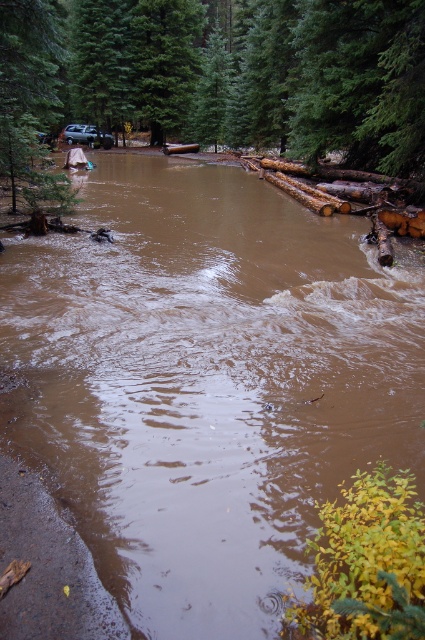
Is green matte tree at upper left wider than metallic silver suv at upper left?

Yes, green matte tree at upper left is wider than metallic silver suv at upper left.

Is green matte tree at upper left below metallic silver suv at upper left?

Yes, green matte tree at upper left is below metallic silver suv at upper left.

Who is more forward, (2, 4) or (73, 125)?

Point (2, 4)

Identify the location of green matte tree at upper left. tap(28, 80).

Measure the distance between green matte tree at upper center and green matte tree at upper left.

7.55 meters

Does green matte tree at upper center lie in front of green matte tree at upper left?

No, green matte tree at upper center is behind green matte tree at upper left.

Image resolution: width=425 pixels, height=640 pixels. I want to click on green matte tree at upper center, so point(224,74).

Does green matte tree at upper center appear on the left side of metallic silver suv at upper left?

No, green matte tree at upper center is not to the left of metallic silver suv at upper left.

Does point (150, 10) come in front of point (95, 125)?

Yes.

Where is `green matte tree at upper center`? The image size is (425, 640). green matte tree at upper center is located at coordinates (224, 74).